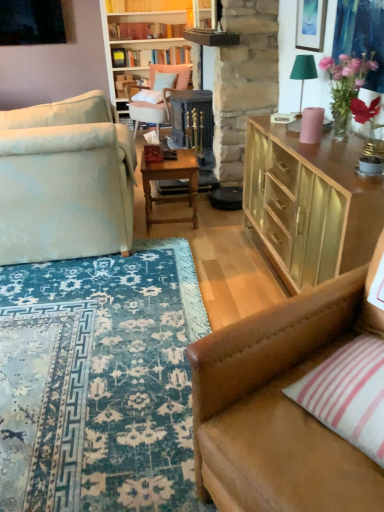
This screenshot has width=384, height=512. Describe the element at coordinates (157, 95) in the screenshot. I see `pink fabric chair at upper center` at that location.

In order to face pink glass vase at upper right, should I rotate leftwards or rightwards?

To align with it, rotate right about 19.775°.

Find the location of `wooden table at center`. wooden table at center is located at coordinates (171, 178).

Image resolution: width=384 pixels, height=512 pixels. Describe the element at coordinates (171, 178) in the screenshot. I see `wooden table at center` at that location.

What do you see at coordinates (151, 57) in the screenshot? The height and width of the screenshot is (512, 384). I see `hardcover books at upper center, marked as the 2th book in a top-to-bottom arrangement` at bounding box center [151, 57].

What do you see at coordinates (303, 74) in the screenshot? The width and height of the screenshot is (384, 512). I see `green fabric lampshade at upper right` at bounding box center [303, 74].

At what (x,y) coordinates should I click in order to perform the action: click on pink fabric chair at upper center. Please return your answer as a coordinate pair (x, y). This screenshot has height=512, width=384. Looking at the image, I should click on (157, 95).

Considering the positions of objects hardcover book at upper center, which is counted as the first book, starting from the top, and pink striped fabric pillow at lower right, the 2th pillow when ordered from left to right, in the image provided, who is in front, hardcover book at upper center, which is counted as the first book, starting from the top, or pink striped fabric pillow at lower right, the 2th pillow when ordered from left to right,?

pink striped fabric pillow at lower right, the 2th pillow when ordered from left to right.

Between point (110, 11) and point (325, 408), which one is positioned behind?

The point (110, 11) is farther.

How much distance is there between hardcover book at upper center, acting as the second book starting from the back, and pink striped fabric pillow at lower right, the 2th pillow when ordered from left to right?

hardcover book at upper center, acting as the second book starting from the back, is 4.82 meters from pink striped fabric pillow at lower right, the 2th pillow when ordered from left to right.

From the image's perspective, would you say hardcover book at upper center, acting as the 1th book starting from the front, is shown under pink striped fabric pillow at lower right, positioned as the second pillow in back-to-front order?

No, from the image's perspective, hardcover book at upper center, acting as the 1th book starting from the front, is not beneath pink striped fabric pillow at lower right, positioned as the second pillow in back-to-front order.

From the image's perspective, which is above, wooden table at center or matte gold cabinet at upper right?

wooden table at center appears higher in the image.

In the image, is wooden table at center on the left side or the right side of matte gold cabinet at upper right?

Clearly, wooden table at center is on the left of matte gold cabinet at upper right in the image.

Does wooden table at center have a larger size compared to matte gold cabinet at upper right?

No.

From a real-world perspective, is wooden table at center positioned above or below matte gold cabinet at upper right?

In terms of real-world spatial position, wooden table at center is below matte gold cabinet at upper right.

Which book is the 2nd one when counting from the back of the brown leather couch at lower right, which is the 1th studio couch in bottom-to-top order? Please provide its 2D coordinates.

[(151, 57)]

Does hardcover books at upper center, marked as the 2th book in a top-to-bottom arrangement, have a greater height compared to brown leather couch at lower right, which is the 1th studio couch in bottom-to-top order?

No, hardcover books at upper center, marked as the 2th book in a top-to-bottom arrangement, is not taller than brown leather couch at lower right, which is the 1th studio couch in bottom-to-top order.

How different are the orientations of hardcover books at upper center, the first book in the bottom-to-top sequence, and brown leather couch at lower right, the first studio couch viewed from the front, in degrees?

The angle between the facing direction of hardcover books at upper center, the first book in the bottom-to-top sequence, and the facing direction of brown leather couch at lower right, the first studio couch viewed from the front, is 64 degrees.

Does hardcover books at upper center, the first book in the bottom-to-top sequence, come in front of brown leather couch at lower right, the first studio couch viewed from the front?

No, hardcover books at upper center, the first book in the bottom-to-top sequence, is further to the viewer.

Considering the relative positions of white fabric pillow at center, which ranks as the 1th pillow in left-to-right order, and brown leather couch at lower right, the first studio couch viewed from the front, in the image provided, is white fabric pillow at center, which ranks as the 1th pillow in left-to-right order, to the left or to the right of brown leather couch at lower right, the first studio couch viewed from the front,?

From the image, it's evident that white fabric pillow at center, which ranks as the 1th pillow in left-to-right order, is to the left of brown leather couch at lower right, the first studio couch viewed from the front.

Considering the sizes of objects white fabric pillow at center, the second pillow when ordered from right to left, and brown leather couch at lower right, arranged as the 1th studio couch when viewed from the right, in the image provided, who is bigger, white fabric pillow at center, the second pillow when ordered from right to left, or brown leather couch at lower right, arranged as the 1th studio couch when viewed from the right,?

Bigger between the two is brown leather couch at lower right, arranged as the 1th studio couch when viewed from the right.

Is white fabric pillow at center, which is the second pillow from front to back, turned away from brown leather couch at lower right, marked as the second studio couch in a back-to-front arrangement?

white fabric pillow at center, which is the second pillow from front to back, is not turned away from brown leather couch at lower right, marked as the second studio couch in a back-to-front arrangement.

Is pink glass vase at upper right bigger than wooden table at center?

No.

From the image's perspective, would you say pink glass vase at upper right is shown under wooden table at center?

No, from the image's perspective, pink glass vase at upper right is not beneath wooden table at center.

Considering their positions, is pink glass vase at upper right located in front of or behind wooden table at center?

Clearly, pink glass vase at upper right is in front of wooden table at center.

Is pink glass vase at upper right next to wooden table at center?

No, pink glass vase at upper right is not making contact with wooden table at center.

From the image's perspective, does hardcover book at upper center, acting as the 1th book starting from the front, appear higher than pink glass vase at upper right?

Yes, from the image's perspective, hardcover book at upper center, acting as the 1th book starting from the front, is above pink glass vase at upper right.

Is hardcover book at upper center, acting as the 1th book starting from the front, to the left of pink glass vase at upper right from the viewer's perspective?

Yes, hardcover book at upper center, acting as the 1th book starting from the front, is to the left of pink glass vase at upper right.

In terms of width, does hardcover book at upper center, the second book in the bottom-to-top sequence, look wider or thinner when compared to pink glass vase at upper right?

Considering their sizes, hardcover book at upper center, the second book in the bottom-to-top sequence, looks slimmer than pink glass vase at upper right.

At what (x,y) coordinates should I click in order to perform the action: click on the 1st pillow above the pink fabric chair at upper center (from a real-world perspective). Please return your answer as a coordinate pair (x, y). Looking at the image, I should click on (348, 394).

From a real-world perspective, is pink striped fabric pillow at lower right, positioned as the second pillow in back-to-front order, beneath pink fabric chair at upper center?

No.

Can you confirm if pink striped fabric pillow at lower right, which is counted as the 1th pillow, starting from the front, is bigger than pink fabric chair at upper center?

Actually, pink striped fabric pillow at lower right, which is counted as the 1th pillow, starting from the front, might be smaller than pink fabric chair at upper center.

From the picture: Considering the sizes of objects pink striped fabric pillow at lower right, which is counted as the 1th pillow, starting from the front, and pink fabric chair at upper center in the image provided, who is shorter, pink striped fabric pillow at lower right, which is counted as the 1th pillow, starting from the front, or pink fabric chair at upper center?

Standing shorter between the two is pink striped fabric pillow at lower right, which is counted as the 1th pillow, starting from the front.

Which book is the 1st one when counting from the back of the pink striped fabric pillow at lower right, the 1th pillow in the bottom-to-top sequence? Please provide its 2D coordinates.

[(146, 5)]

At what (x,y) coordinates should I click in order to perform the action: click on table located on the left of matte gold cabinet at upper right. Please return your answer as a coordinate pair (x, y). The height and width of the screenshot is (512, 384). Looking at the image, I should click on (171, 178).

Looking at the image, which one is located closer to matte gold picture frame at upper right, pink glass vase at upper right or wooden table at center?

The object closer to matte gold picture frame at upper right is pink glass vase at upper right.

Based on their spatial positions, is brown leather couch at lower right, the first studio couch viewed from the front, or hardcover books at upper center, which ranks as the first book in back-to-front order, closer to light beige fabric couch at left, placed as the first studio couch when sorted from top to bottom?

The object closer to light beige fabric couch at left, placed as the first studio couch when sorted from top to bottom, is brown leather couch at lower right, the first studio couch viewed from the front.

Which object lies nearer to the anchor point light beige fabric couch at left, acting as the first studio couch starting from the back, matte gold cabinet at upper right or pink striped fabric pillow at lower right, which is counted as the 1th pillow, starting from the front?

matte gold cabinet at upper right is closer to light beige fabric couch at left, acting as the first studio couch starting from the back.

When comparing their distances from brown leather couch at lower right, the second studio couch viewed from the top, does green fabric lampshade at upper right or pink glass vase at upper right seem further?

green fabric lampshade at upper right.

Looking at the image, which one is located closer to brown leather couch at lower right, the second studio couch viewed from the left, hardcover books at upper center, the first book in the bottom-to-top sequence, or matte gold picture frame at upper right?

Based on the image, matte gold picture frame at upper right appears to be nearer to brown leather couch at lower right, the second studio couch viewed from the left.

Considering their positions, is pink glass vase at upper right positioned further to pink fabric chair at upper center than matte gold picture frame at upper right?

Among the two, pink glass vase at upper right is located further to pink fabric chair at upper center.

From the image, which object appears to be nearer to matte gold cabinet at upper right, hardcover book at upper center, which is counted as the first book, starting from the top, or pink striped fabric pillow at lower right, acting as the first pillow starting from the right?

pink striped fabric pillow at lower right, acting as the first pillow starting from the right, is positioned closer to the anchor matte gold cabinet at upper right.

From the image, which object appears to be farther from hardcover book at upper center, which is counted as the first book, starting from the top, light beige fabric couch at left, which is the first studio couch from left to right, or pink fabric chair at upper center?

light beige fabric couch at left, which is the first studio couch from left to right, is further to hardcover book at upper center, which is counted as the first book, starting from the top.

The height and width of the screenshot is (512, 384). I want to click on picture frame between pink striped fabric pillow at lower right, which is the 2th pillow from top to bottom, and wooden table at center, along the z-axis, so click(x=310, y=24).

You are a GUI agent. You are given a task and a screenshot of the screen. Output one action in this format:
    pyautogui.click(x=<x>, y=<y>)
    Task: Click on the studio couch between pink glass vase at upper right and hardcover book at upper center, acting as the second book starting from the back, from front to back
    The width and height of the screenshot is (384, 512).
    Given the screenshot: What is the action you would take?
    pyautogui.click(x=65, y=181)

You are a GUI agent. You are given a task and a screenshot of the screen. Output one action in this format:
    pyautogui.click(x=<x>, y=<y>)
    Task: Click on the houseplant between brown leather couch at lower right, the second studio couch viewed from the top, and hardcover book at upper center, the second book in the bottom-to-top sequence, from front to back
    The height and width of the screenshot is (512, 384).
    Given the screenshot: What is the action you would take?
    pyautogui.click(x=345, y=87)

Where is `picture frame between pink glass vase at upper right and hardcover books at upper center, the first book in the bottom-to-top sequence, from front to back`? The height and width of the screenshot is (512, 384). picture frame between pink glass vase at upper right and hardcover books at upper center, the first book in the bottom-to-top sequence, from front to back is located at coordinates (310, 24).